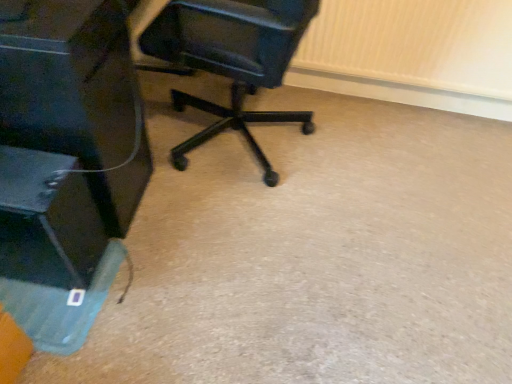
You are a GUI agent. You are given a task and a screenshot of the screen. Output one action in this format:
    pyautogui.click(x=<x>, y=<y>)
    Task: Click on the free location in front of black plastic chair at center
    
    Given the screenshot: What is the action you would take?
    pyautogui.click(x=253, y=251)